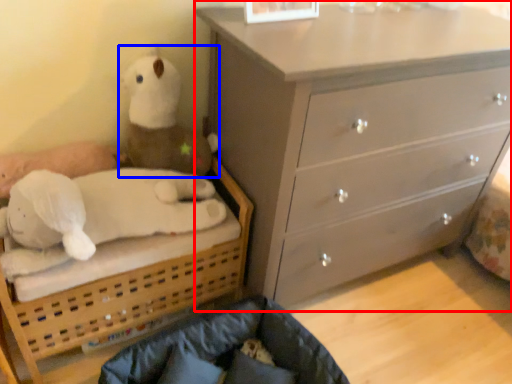
Question: Which point is closer to the camera, chest of drawers (highlighted by a red box) or toy (highlighted by a blue box)?

Choices:
 (A) chest of drawers
 (B) toy

Answer: (A)